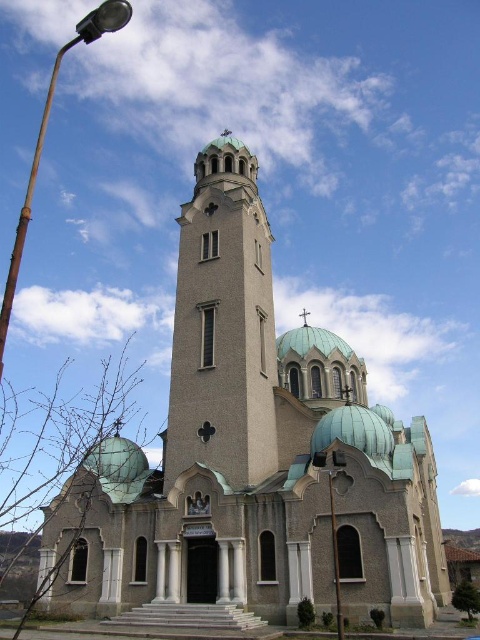
Question: Is smooth concrete bell tower at center below metallic pole at center?

Choices:
 (A) yes
 (B) no

Answer: (B)

Question: Which point is farther from the camera taking this photo?

Choices:
 (A) (19, 253)
 (B) (336, 545)
 (C) (337, 616)

Answer: (A)

Question: Observing the image, what is the correct spatial positioning of beige stone church at center in reference to metallic pole at center?

Choices:
 (A) below
 (B) above

Answer: (B)

Question: Can you confirm if smooth concrete bell tower at center is wider than rusty metal streetlight at left?

Choices:
 (A) no
 (B) yes

Answer: (A)

Question: Which point is closer to the camera taking this photo?

Choices:
 (A) (332, 528)
 (B) (184, 460)
 (C) (422, 502)

Answer: (A)

Question: Which point is closer to the camera?

Choices:
 (A) tap(334, 461)
 (B) tap(166, 593)

Answer: (A)